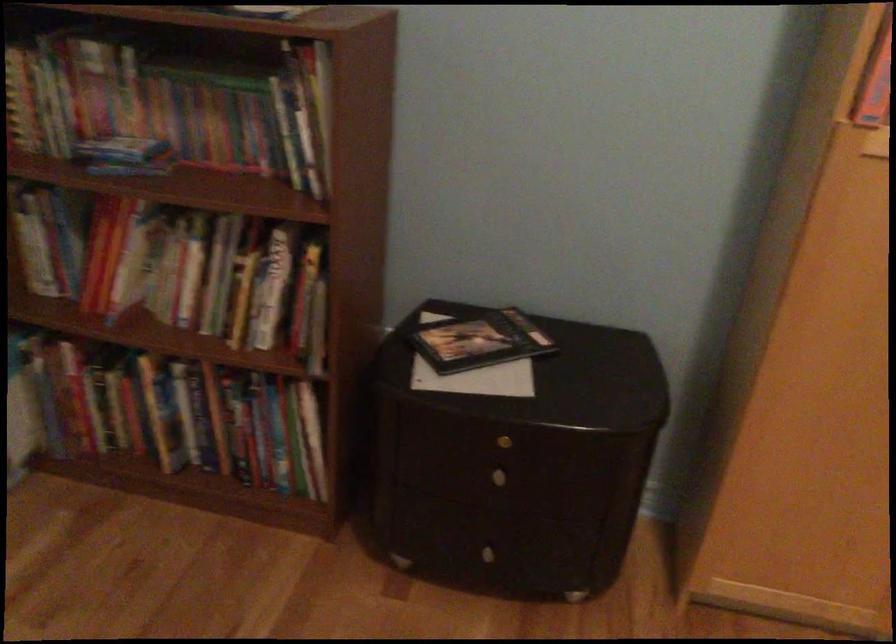
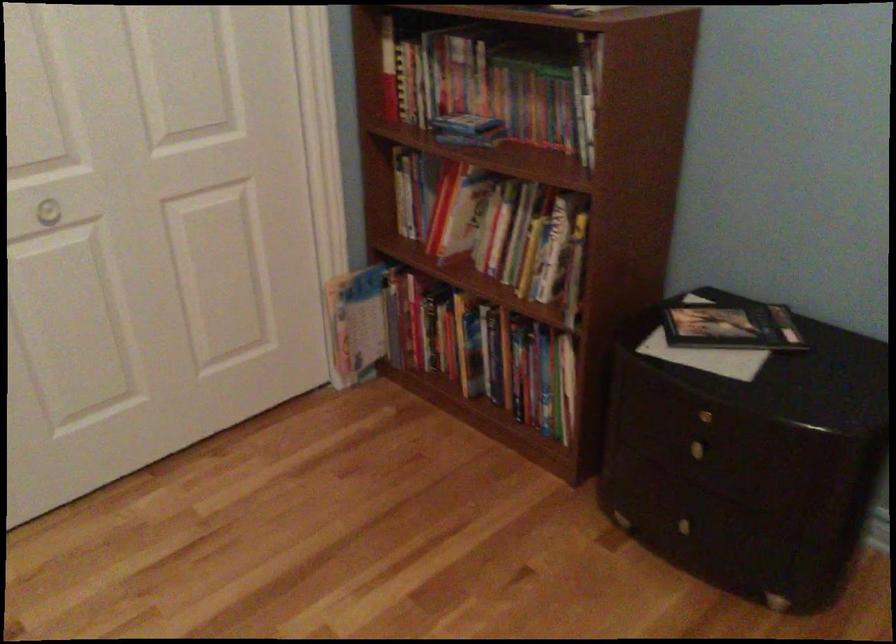
Find the pixel in the second image that matches (x=490, y=545) in the first image.

(690, 518)